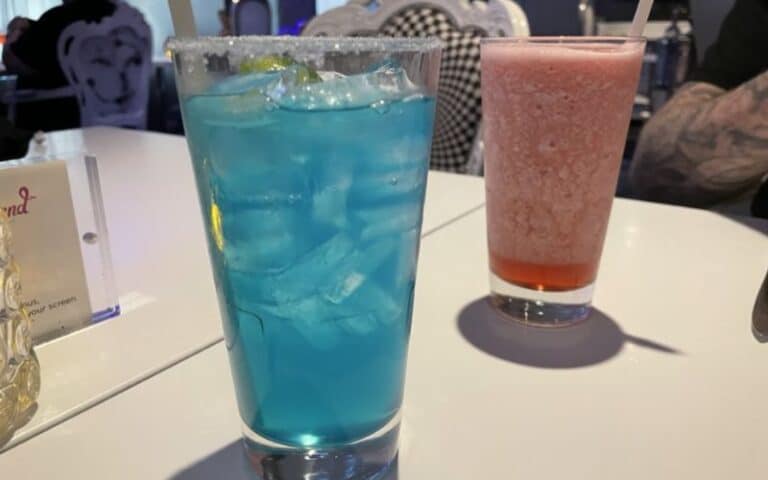
I want to click on plastic placard holder, so click(x=55, y=247).